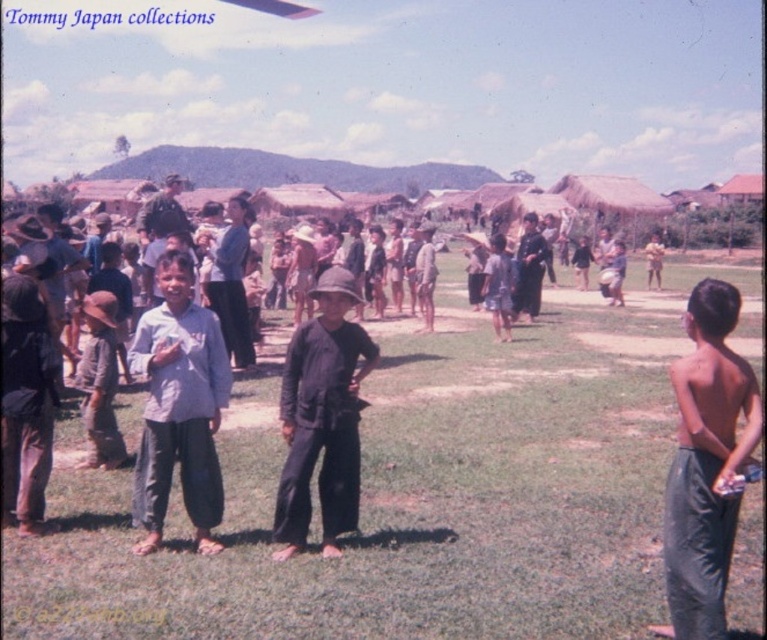
Who is more distant from viewer, (179, 278) or (232, 220)?

Positioned behind is point (232, 220).

Who is higher up, light blue fabric shirt at center or light blue shirt at center?

Positioned higher is light blue shirt at center.

The height and width of the screenshot is (640, 767). Identify the location of light blue fabric shirt at center. (179, 406).

The height and width of the screenshot is (640, 767). What do you see at coordinates (231, 282) in the screenshot?
I see `light blue shirt at center` at bounding box center [231, 282].

Is light blue shirt at center further to camera compared to dark brown leather jacket at center?

No, light blue shirt at center is in front of dark brown leather jacket at center.

Is point (235, 237) in front of point (530, 288)?

Yes, point (235, 237) is closer to viewer.

You are a GUI agent. You are given a task and a screenshot of the screen. Output one action in this format:
    pyautogui.click(x=<x>, y=<y>)
    Task: Click on the light blue shirt at center
    
    Given the screenshot: What is the action you would take?
    pyautogui.click(x=231, y=282)

Measure the distance between green grass at center and light blue shirt at center.

They are 3.50 meters apart.

Which is more to the left, green grass at center or light blue shirt at center?

Positioned to the left is light blue shirt at center.

Is point (736, 634) farther from viewer compared to point (226, 342)?

No, it is in front of (226, 342).

Where is `green grass at center`? green grass at center is located at coordinates (410, 493).